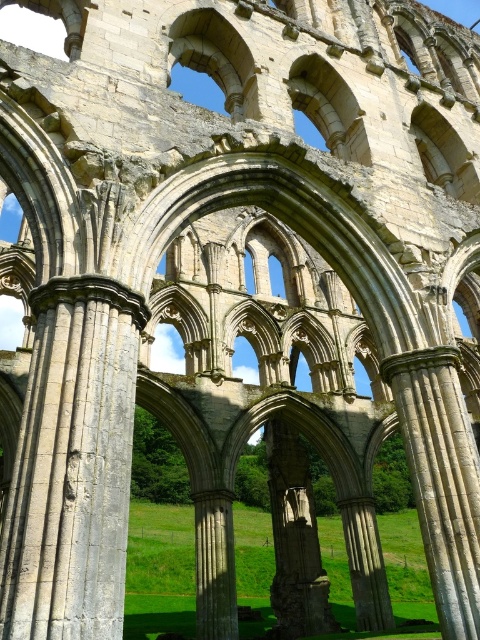
Is gray stone column at center above stone column at center?

Correct, gray stone column at center is located above stone column at center.

Is gray stone column at center bigger than stone column at center?

Correct, gray stone column at center is larger in size than stone column at center.

The image size is (480, 640). What do you see at coordinates (72, 465) in the screenshot? I see `gray stone column at center` at bounding box center [72, 465].

You are a GUI agent. You are given a task and a screenshot of the screen. Output one action in this format:
    pyautogui.click(x=<x>, y=<y>)
    Task: Click on the gray stone column at center
    This screenshot has height=640, width=480.
    Given the screenshot: What is the action you would take?
    pyautogui.click(x=72, y=465)